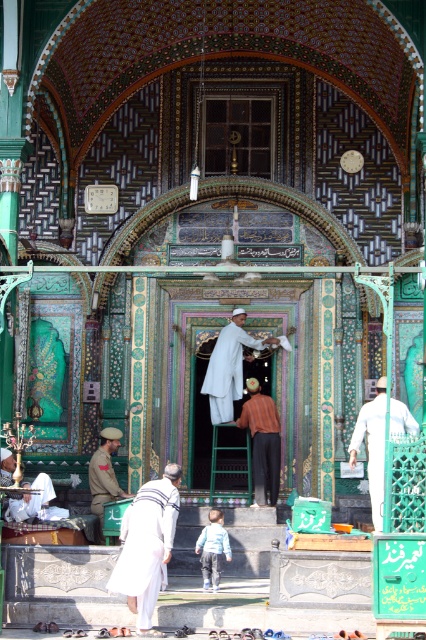
Question: Which of these objects is positioned closest to the white matte clothing at center?

Choices:
 (A) white cotton robe at lower center
 (B) white cotton robe at center

Answer: (B)

Question: Does brown leather robe at center have a greater width compared to light blue cotton shirt at center?

Choices:
 (A) yes
 (B) no

Answer: (A)

Question: Does white cotton robe at lower center have a lesser width compared to light blue cotton shirt at center?

Choices:
 (A) no
 (B) yes

Answer: (A)

Question: Based on their relative distances, which object is nearer to the brown leather robe at center?

Choices:
 (A) white cotton robe at center
 (B) light blue cotton shirt at center
 (C) white cotton robe at lower center
 (D) khaki uniform at lower left

Answer: (A)

Question: Is khaki uniform at lower left closer to the viewer compared to light blue cotton shirt at center?

Choices:
 (A) yes
 (B) no

Answer: (B)

Question: Among these points, which one is farthest from the camera?

Choices:
 (A) 103,428
 (B) 396,426
 (C) 218,573
 (D) 112,584

Answer: (A)